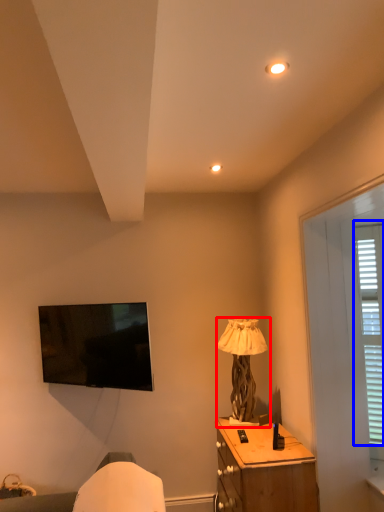
Question: Which point is closer to the camera, lamp (highlighted by a red box) or bay window (highlighted by a blue box)?

Choices:
 (A) lamp
 (B) bay window

Answer: (B)